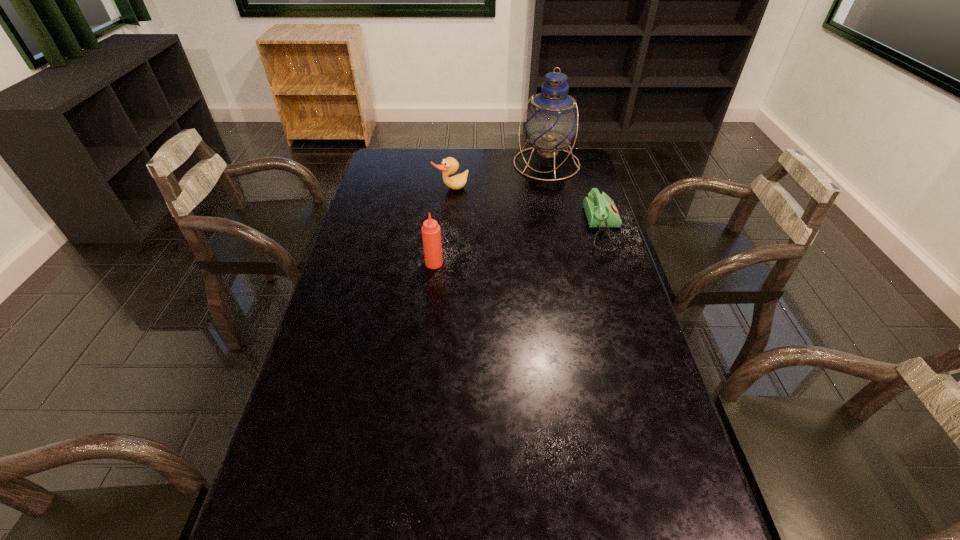
The image size is (960, 540). What are the coordinates of `Tabasco sauce` in the screenshot? It's located at (431, 234).

You are a GUI agent. You are given a task and a screenshot of the screen. Output one action in this format:
    pyautogui.click(x=<x>, y=<y>)
    Task: Click on the telephone
    The width and height of the screenshot is (960, 540).
    Given the screenshot: What is the action you would take?
    pyautogui.click(x=600, y=210)

Locate an element on the screen. Image resolution: width=960 pixels, height=540 pixels. the farthest object is located at coordinates (551, 122).

Locate an element on the screen. The height and width of the screenshot is (540, 960). lantern is located at coordinates (551, 122).

Find the location of a particular element. This screenshot has width=960, height=540. duck is located at coordinates (449, 166).

At what (x,y) coordinates should I click in order to perform the action: click on the second shortest object. Please return your answer as a coordinate pair (x, y). Looking at the image, I should click on (449, 166).

Find the location of a particular element. The image size is (960, 540). vacant space positioned on the back of the Tabasco sauce is located at coordinates (440, 210).

Where is `vacant space situated on the front-facing side of the farthest object`? This screenshot has width=960, height=540. vacant space situated on the front-facing side of the farthest object is located at coordinates pyautogui.click(x=532, y=191).

The image size is (960, 540). I want to click on vacant space located on the front-facing side of the farthest object, so click(514, 222).

Identify the location of free region located 0.050m on the front-facing side of the farthest object. The width and height of the screenshot is (960, 540). (534, 187).